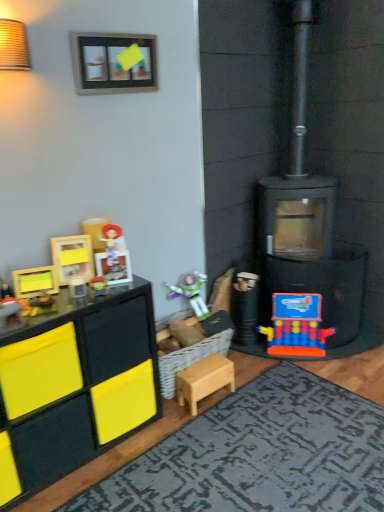
Question: Is wooden picture frame at upper center directly adjacent to black matte fireplace at right?

Choices:
 (A) no
 (B) yes

Answer: (A)

Question: From a real-world perspective, is wooden picture frame at upper center beneath black matte fireplace at right?

Choices:
 (A) no
 (B) yes

Answer: (A)

Question: From a real-world perspective, is wooden picture frame at upper center on top of black matte fireplace at right?

Choices:
 (A) no
 (B) yes

Answer: (B)

Question: Does wooden picture frame at upper center have a larger size compared to black matte fireplace at right?

Choices:
 (A) yes
 (B) no

Answer: (B)

Question: Is wooden picture frame at upper center positioned behind black matte fireplace at right?

Choices:
 (A) no
 (B) yes

Answer: (A)

Question: Is textured gray rug at lower center taller or shorter than black matte fireplace at right?

Choices:
 (A) short
 (B) tall

Answer: (A)

Question: Considering the positions of point (211, 452) and point (292, 201), is point (211, 452) closer or farther from the camera than point (292, 201)?

Choices:
 (A) farther
 (B) closer

Answer: (B)

Question: Considering the relative positions of textured gray rug at lower center and black matte fireplace at right in the image provided, is textured gray rug at lower center to the left or to the right of black matte fireplace at right?

Choices:
 (A) right
 (B) left

Answer: (B)

Question: In the image, is textured gray rug at lower center positioned in front of or behind black matte fireplace at right?

Choices:
 (A) behind
 (B) front

Answer: (B)

Question: Is textured gray rug at lower center situated inside matte black toy at left, the 5th toy viewed from the right, or outside?

Choices:
 (A) inside
 (B) outside

Answer: (B)

Question: Considering the positions of point (322, 476) and point (3, 306), is point (322, 476) closer or farther from the camera than point (3, 306)?

Choices:
 (A) farther
 (B) closer

Answer: (B)

Question: Is textured gray rug at lower center in front of or behind matte black toy at left, arranged as the 5th toy when viewed from the back, in the image?

Choices:
 (A) front
 (B) behind

Answer: (A)

Question: From a real-world perspective, relative to matte black toy at left, the 5th toy viewed from the right, is textured gray rug at lower center vertically above or below?

Choices:
 (A) above
 (B) below

Answer: (B)

Question: Choose the correct answer: Is wooden picture frame at upper center inside black matte fireplace at right or outside it?

Choices:
 (A) outside
 (B) inside

Answer: (A)

Question: From the image's perspective, is wooden picture frame at upper center above or below black matte fireplace at right?

Choices:
 (A) above
 (B) below

Answer: (A)